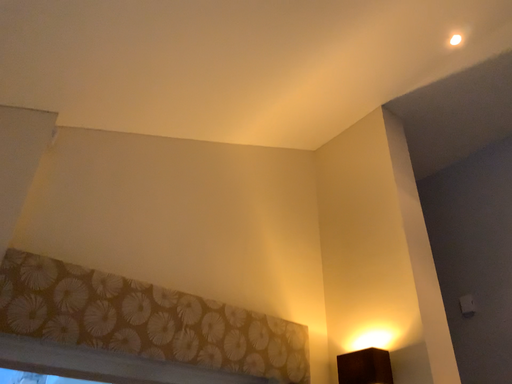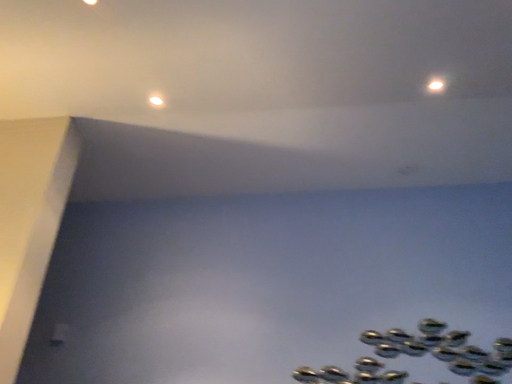
Question: Which way did the camera rotate in the video?

Choices:
 (A) rotated upward
 (B) rotated downward

Answer: (B)